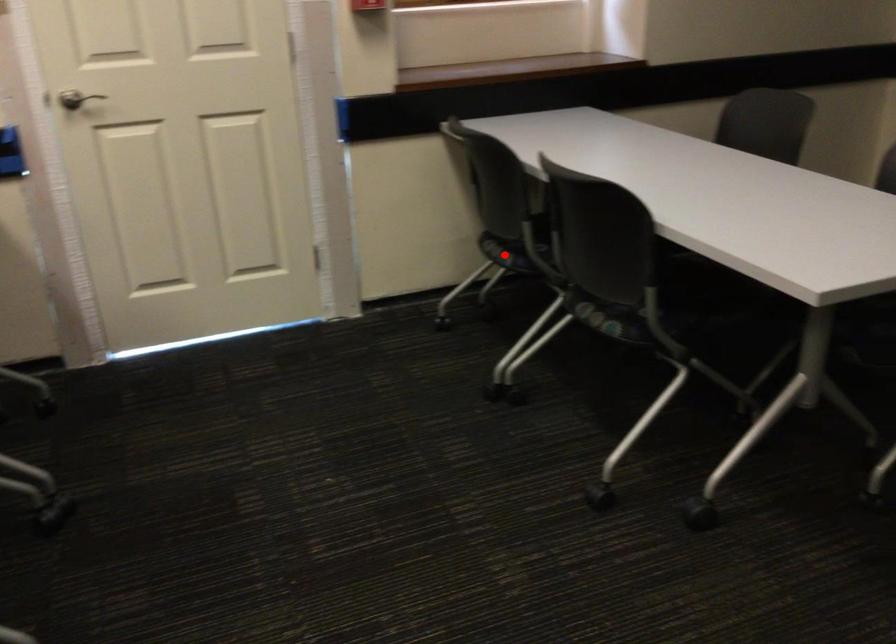
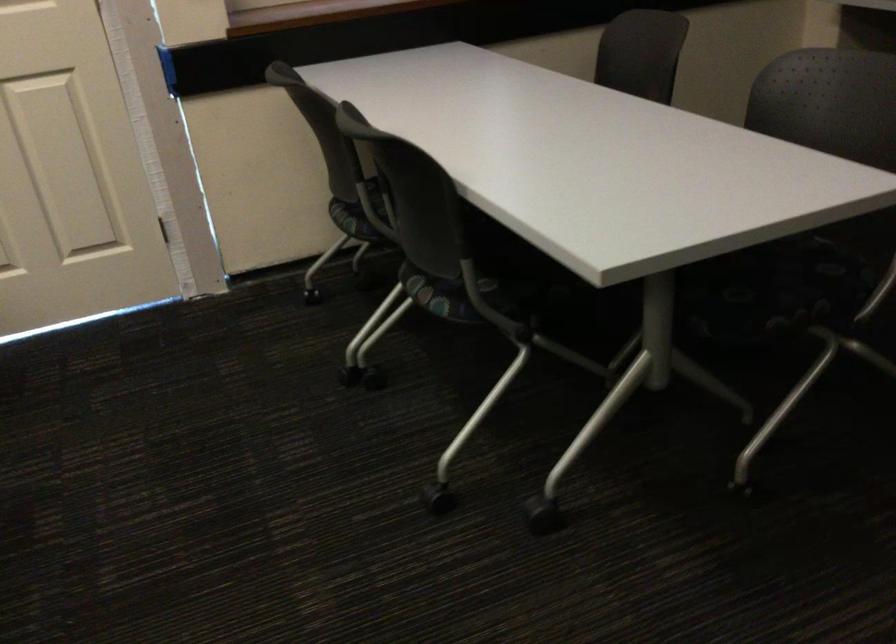
Question: I am providing you with two images of the same scene from different viewpoints. Image1 has a red point marked. In image2, the corresponding 3D location appears at what relative position? Reply with the corresponding letter.

Choices:
 (A) Closer
 (B) Farther

Answer: (A)